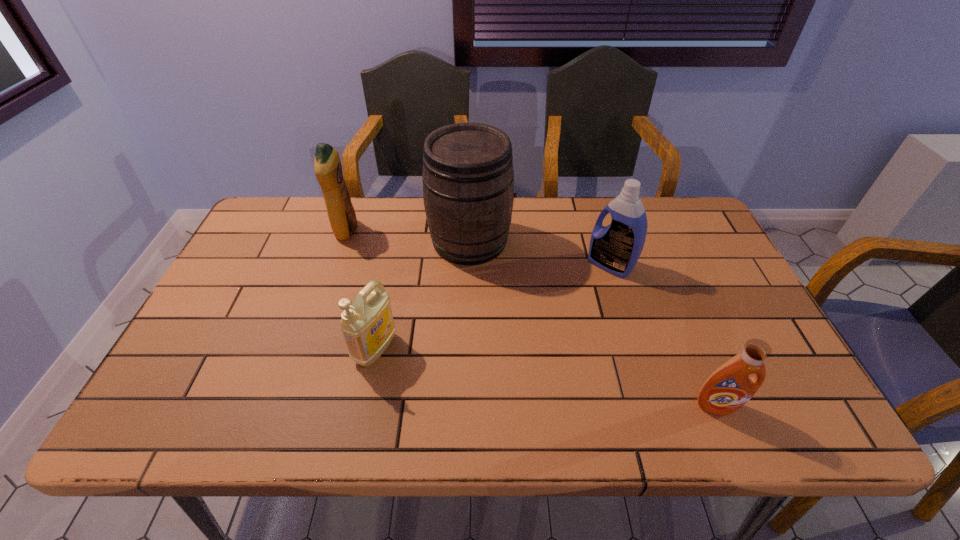
The width and height of the screenshot is (960, 540). I want to click on blank region between the third detergent from left to right and the nearest detergent, so click(663, 335).

Locate an element on the screen. The height and width of the screenshot is (540, 960). object that is the closest one to the rightmost detergent is located at coordinates (616, 248).

Image resolution: width=960 pixels, height=540 pixels. What are the coordinates of `the third closest object to the wine bucket` in the screenshot? It's located at (327, 165).

At what (x,y) coordinates should I click in order to perform the action: click on detergent that is the second closest to the fourth farthest object. Please return your answer as a coordinate pair (x, y). Looking at the image, I should click on (616, 248).

Find the location of a particular element. detergent object that ranks as the third closest to the farthest detergent is located at coordinates (729, 387).

Identify the location of free location that satisfies the following two spatial constraints: 1. on the label of the farthest detergent; 2. on the right side of the second nearest detergent. The image size is (960, 540). (306, 349).

Find the location of a particular element. This screenshot has width=960, height=540. free space that satisfies the following two spatial constraints: 1. on the front side of the third detergent from left to right; 2. on the right side of the wine bucket is located at coordinates (470, 265).